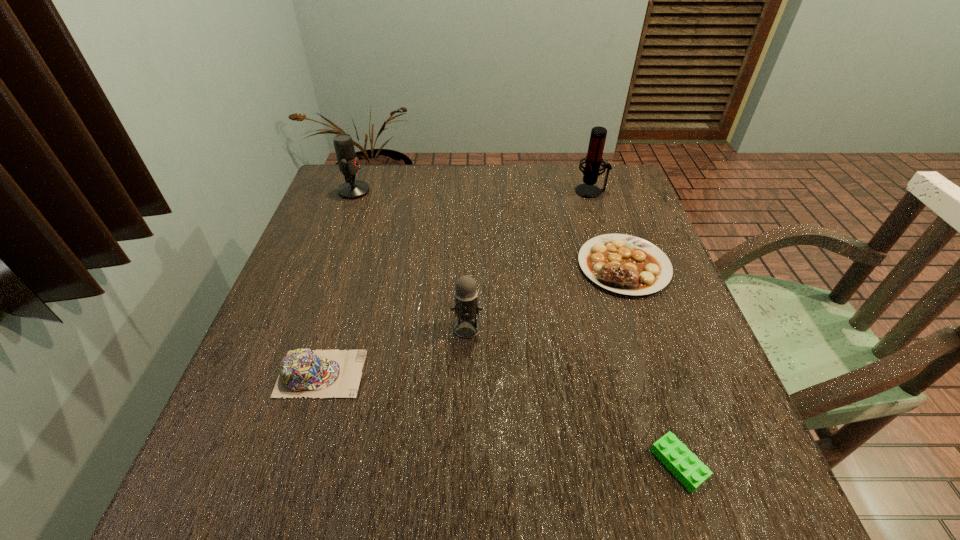
In order to click on empty space between the fourth nearest object and the rightmost microphone in this screenshot , I will do `click(607, 228)`.

Find the location of a particular element. object that is the second closest to the third shortest object is located at coordinates (624, 264).

Find the location of a particular element. Image resolution: width=960 pixels, height=540 pixels. object that can be found as the second closest to the third object from left to right is located at coordinates click(x=624, y=264).

This screenshot has width=960, height=540. Find the location of `microphone that is the closest to the cap`. microphone that is the closest to the cap is located at coordinates (466, 307).

Locate an element on the screen. The height and width of the screenshot is (540, 960). microphone that stands as the closest to the nearest object is located at coordinates (466, 307).

Identify the location of vacant region that satisfies the following two spatial constraints: 1. on the side of the leftmost microphone with the red ring; 2. on the left side of the second shortest object. The height and width of the screenshot is (540, 960). (326, 266).

You are a GUI agent. You are given a task and a screenshot of the screen. Output one action in this format:
    pyautogui.click(x=<x>, y=<y>)
    Task: Click on the vacant area that satisfies the following two spatial constraints: 1. on the side of the leftmost microphone with the red ring; 2. on the left side of the shortest object
    
    Given the screenshot: What is the action you would take?
    pyautogui.click(x=253, y=464)

Where is `free space that satisfies the following two spatial constraints: 1. on the front, side, and top of the nearest object; 2. on the right side of the third shortest object`? This screenshot has width=960, height=540. free space that satisfies the following two spatial constraints: 1. on the front, side, and top of the nearest object; 2. on the right side of the third shortest object is located at coordinates (294, 464).

Where is `blank space that satisfies the following two spatial constraints: 1. on the back side of the rightmost microphone; 2. on the side of the leftmost microphone with the red ring`? The image size is (960, 540). blank space that satisfies the following two spatial constraints: 1. on the back side of the rightmost microphone; 2. on the side of the leftmost microphone with the red ring is located at coordinates (590, 191).

At what (x,y) coordinates should I click in order to perform the action: click on vacant space that satisfies the following two spatial constraints: 1. on the back side of the shortest object; 2. on the front, side, and top of the second nearest object. Please return your answer as a coordinate pair (x, y). This screenshot has height=540, width=960. Looking at the image, I should click on (649, 374).